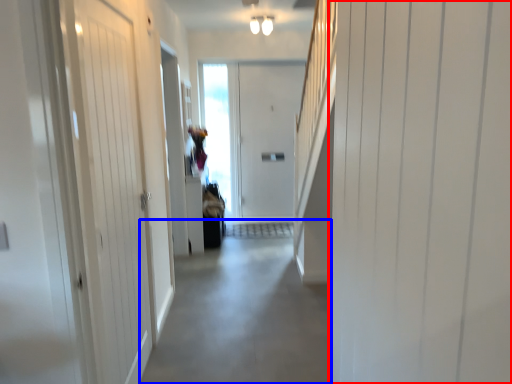
Question: Which of the following is the farthest to the observer, door (highlighted by a red box) or alley (highlighted by a blue box)?

Choices:
 (A) door
 (B) alley

Answer: (B)